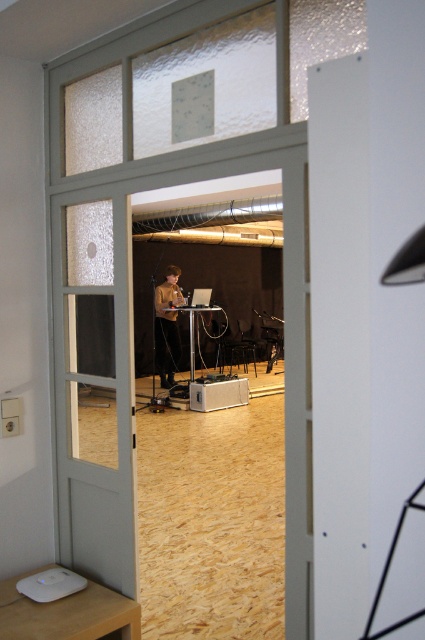
Question: From the image, what is the correct spatial relationship of clear glass door at center in relation to matte brown sweater at center?

Choices:
 (A) right
 (B) left

Answer: (B)

Question: Which of the following is the closest to the observer?

Choices:
 (A) (96, 326)
 (B) (181, 298)

Answer: (A)

Question: Is clear glass door at center further to the viewer compared to matte brown sweater at center?

Choices:
 (A) yes
 (B) no

Answer: (B)

Question: Does clear glass door at center appear on the left side of matte brown sweater at center?

Choices:
 (A) yes
 (B) no

Answer: (A)